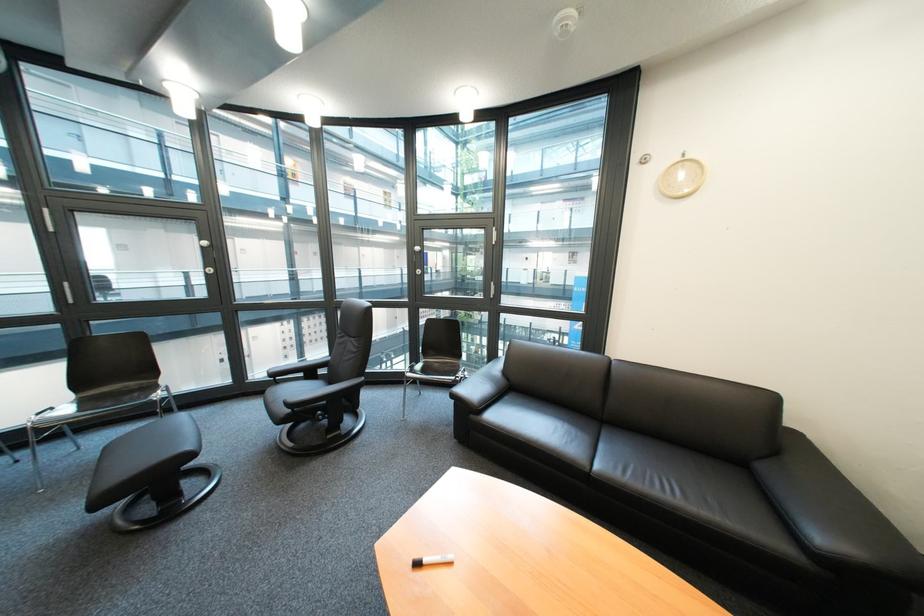
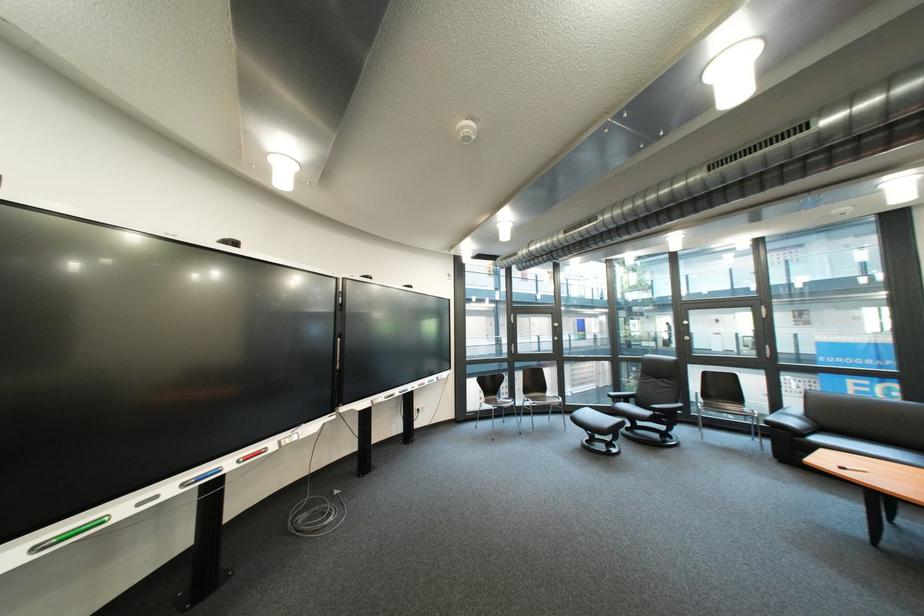
Where in the second image is the point corresponding to the point at 517,374 from the first image?

(822, 418)